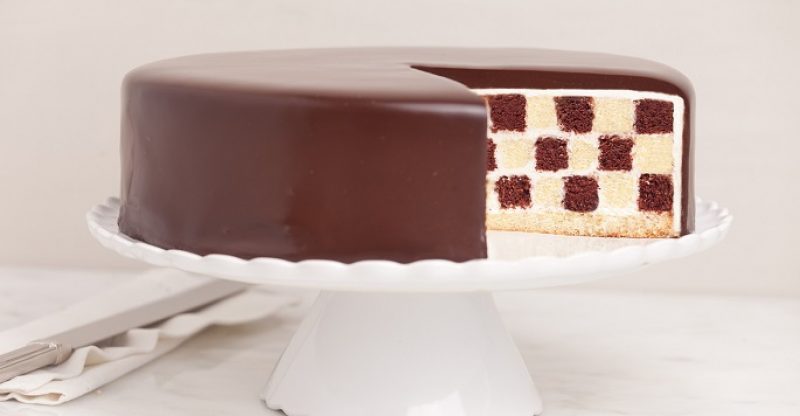
Locate an element on the screen. The height and width of the screenshot is (416, 800). background wall is located at coordinates (742, 131).